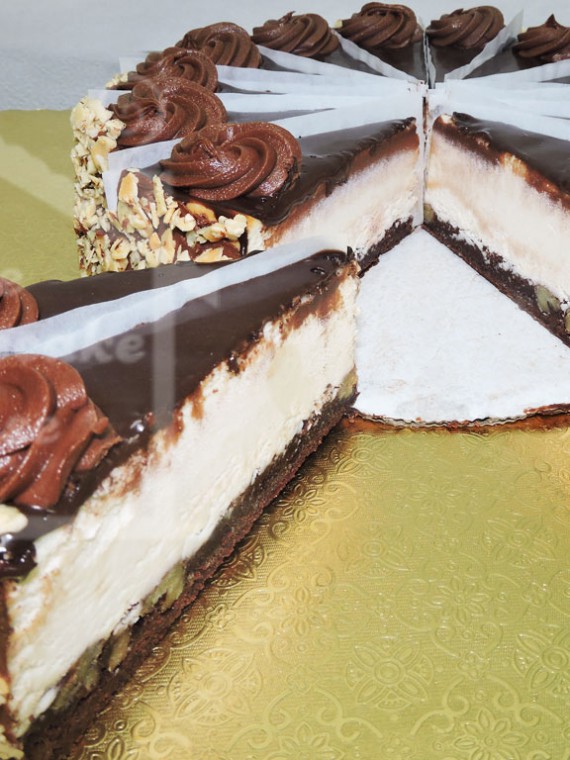
Identify the location of tray. The width and height of the screenshot is (570, 760). (316, 670).